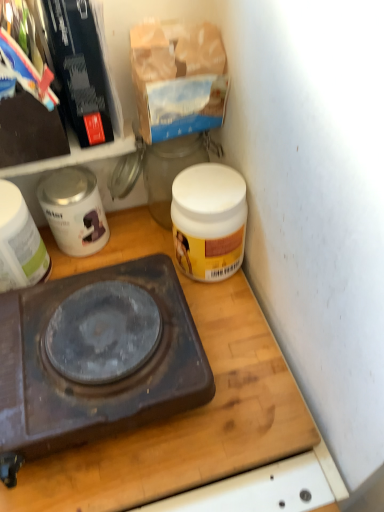
The width and height of the screenshot is (384, 512). What are the coordinates of `wooden cutting board at center` in the screenshot? It's located at (187, 421).

Locate an element on the screen. white glossy canister at upper left, the 2th appliance positioned from the left is located at coordinates (74, 210).

I want to click on white matte jar at upper right, so click(x=209, y=221).

What's the angular difference between wooden cutting board at center and white glossy jar at left, the first appliance positioned from the left,'s facing directions?

The facing directions of wooden cutting board at center and white glossy jar at left, the first appliance positioned from the left, are 0.0003 degrees apart.

Based on the photo, from the image's perspective, is wooden cutting board at center over white glossy jar at left, arranged as the 2th appliance when viewed from the right?

No, from the image's perspective, wooden cutting board at center is not over white glossy jar at left, arranged as the 2th appliance when viewed from the right.

Between wooden cutting board at center and white glossy jar at left, arranged as the 2th appliance when viewed from the right, which one has less height?

Standing shorter between the two is wooden cutting board at center.

From a real-world perspective, which object rests below the other?

wooden cutting board at center is physically lower.

Is white glossy canister at upper left, the 2th appliance positioned from the left, surrounding wooden cutting board at center?

No.

Does white glossy canister at upper left, the 2th appliance positioned from the left, have a lesser height compared to wooden cutting board at center?

Incorrect, the height of white glossy canister at upper left, the 2th appliance positioned from the left, does not fall short of that of wooden cutting board at center.

Considering the relative sizes of wooden cutting board at center and white matte jar at upper right in the image provided, is wooden cutting board at center smaller than white matte jar at upper right?

Actually, wooden cutting board at center might be larger than white matte jar at upper right.

You are a GUI agent. You are given a task and a screenshot of the screen. Output one action in this format:
    pyautogui.click(x=<x>, y=<y>)
    Task: Click on the product that appears above the wooden cutting board at center (from a real-world perspective)
    This screenshot has width=384, height=512.
    Given the screenshot: What is the action you would take?
    pyautogui.click(x=209, y=221)

Is wooden cutting board at center in contact with white matte jar at upper right?

No, wooden cutting board at center is not making contact with white matte jar at upper right.

From a real-world perspective, is white glossy jar at left, the first appliance positioned from the left, positioned under wooden cutting board at center based on gravity?

No, from a real-world perspective, white glossy jar at left, the first appliance positioned from the left, is not under wooden cutting board at center.

Is wooden cutting board at center at the back of white glossy jar at left, arranged as the 2th appliance when viewed from the right?

No, white glossy jar at left, arranged as the 2th appliance when viewed from the right, is not facing the opposite direction of wooden cutting board at center.

Find the location of `the 2nd appliance counting from the left side of the wooden cutting board at center`. the 2nd appliance counting from the left side of the wooden cutting board at center is located at coordinates (19, 242).

Between white glossy jar at left, arranged as the 2th appliance when viewed from the right, and wooden cutting board at center, which one has more height?

With more height is white glossy jar at left, arranged as the 2th appliance when viewed from the right.

Between wooden cutting board at center and dark brown plastic gas stove at center, which one has larger size?

Bigger between the two is dark brown plastic gas stove at center.

Considering their positions, is wooden cutting board at center located in front of or behind dark brown plastic gas stove at center?

wooden cutting board at center is positioned farther from the viewer than dark brown plastic gas stove at center.

From the image's perspective, which one is positioned lower, wooden cutting board at center or dark brown plastic gas stove at center?

dark brown plastic gas stove at center is shown below in the image.

Would you consider white matte jar at upper right to be distant from white glossy canister at upper left, the 2th appliance positioned from the left?

That's not correct — white matte jar at upper right is a little close to white glossy canister at upper left, the 2th appliance positioned from the left.

From the image's perspective, is white matte jar at upper right on white glossy canister at upper left, placed as the first appliance when sorted from right to left?

No, from the image's perspective, white matte jar at upper right is not over white glossy canister at upper left, placed as the first appliance when sorted from right to left.

Considering the relative sizes of white matte jar at upper right and white glossy canister at upper left, the 2th appliance positioned from the left, in the image provided, is white matte jar at upper right wider than white glossy canister at upper left, the 2th appliance positioned from the left,?

Yes.

Is white matte jar at upper right in front of white glossy canister at upper left, the 2th appliance positioned from the left?

Yes.

Looking at their sizes, would you say white matte jar at upper right is wider or thinner than white glossy jar at left, the first appliance positioned from the left?

Considering their sizes, white matte jar at upper right looks slimmer than white glossy jar at left, the first appliance positioned from the left.

Does point (199, 165) lie in front of point (2, 281)?

No, it is behind (2, 281).

From a real-world perspective, who is located higher, white matte jar at upper right or white glossy jar at left, the first appliance positioned from the left?

white glossy jar at left, the first appliance positioned from the left, is physically above.

Is white matte jar at upper right positioned in front of white glossy jar at left, arranged as the 2th appliance when viewed from the right?

No, white matte jar at upper right is behind white glossy jar at left, arranged as the 2th appliance when viewed from the right.

Where is `table lying on the right of white glossy jar at left, the first appliance positioned from the left`? The width and height of the screenshot is (384, 512). table lying on the right of white glossy jar at left, the first appliance positioned from the left is located at coordinates click(x=187, y=421).

Locate an element on the screen. the 1st appliance above the wooden cutting board at center (from a real-world perspective) is located at coordinates (74, 210).

Considering their positions, is white glossy jar at left, the first appliance positioned from the left, positioned further to white matte jar at upper right than dark brown plastic gas stove at center?

The object further to white matte jar at upper right is white glossy jar at left, the first appliance positioned from the left.

When comparing their distances from white glossy jar at left, the first appliance positioned from the left, does white glossy canister at upper left, the 2th appliance positioned from the left, or wooden cutting board at center seem closer?

The object closer to white glossy jar at left, the first appliance positioned from the left, is white glossy canister at upper left, the 2th appliance positioned from the left.

Considering their positions, is dark brown plastic gas stove at center positioned closer to wooden cutting board at center than white matte jar at upper right?

dark brown plastic gas stove at center is positioned closer to the anchor wooden cutting board at center.

Considering their positions, is white glossy canister at upper left, placed as the first appliance when sorted from right to left, positioned closer to wooden cutting board at center than white matte jar at upper right?

white matte jar at upper right is closer to wooden cutting board at center.

From the image, which object appears to be nearer to dark brown plastic gas stove at center, white glossy canister at upper left, placed as the first appliance when sorted from right to left, or wooden cutting board at center?

Among the two, wooden cutting board at center is located nearer to dark brown plastic gas stove at center.

Considering their positions, is white glossy canister at upper left, the 2th appliance positioned from the left, positioned further to wooden cutting board at center than dark brown plastic gas stove at center?

white glossy canister at upper left, the 2th appliance positioned from the left, lies further to wooden cutting board at center than the other object.

When comparing their distances from white glossy canister at upper left, placed as the first appliance when sorted from right to left, does white matte jar at upper right or wooden cutting board at center seem further?

wooden cutting board at center is positioned further to the anchor white glossy canister at upper left, placed as the first appliance when sorted from right to left.

Considering their positions, is white glossy jar at left, the first appliance positioned from the left, positioned closer to dark brown plastic gas stove at center than white glossy canister at upper left, placed as the first appliance when sorted from right to left?

Based on the image, white glossy jar at left, the first appliance positioned from the left, appears to be nearer to dark brown plastic gas stove at center.

I want to click on table between white matte jar at upper right and dark brown plastic gas stove at center from top to bottom, so click(x=187, y=421).

I want to click on appliance between white glossy canister at upper left, placed as the first appliance when sorted from right to left, and dark brown plastic gas stove at center in the up-down direction, so click(19, 242).

At what (x,y) coordinates should I click in order to perform the action: click on appliance between white glossy jar at left, arranged as the 2th appliance when viewed from the right, and wooden cutting board at center from left to right. Please return your answer as a coordinate pair (x, y). This screenshot has width=384, height=512. Looking at the image, I should click on (74, 210).

This screenshot has width=384, height=512. I want to click on table situated between white glossy jar at left, the first appliance positioned from the left, and white matte jar at upper right from left to right, so click(x=187, y=421).